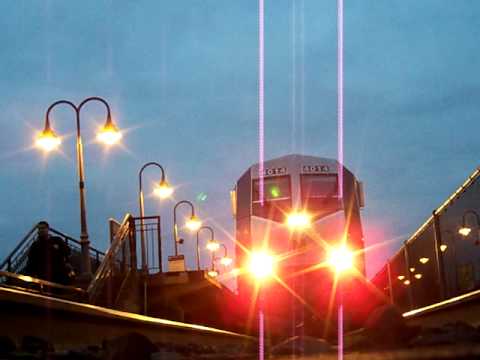
The height and width of the screenshot is (360, 480). I want to click on stairs, so click(x=51, y=262).